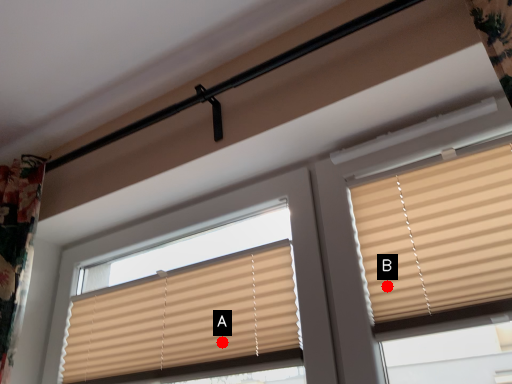
Question: Two points are circled on the image, labeled by A and B beside each circle. Which point appears farthest from the camera in this image?

Choices:
 (A) A is further
 (B) B is further

Answer: (A)